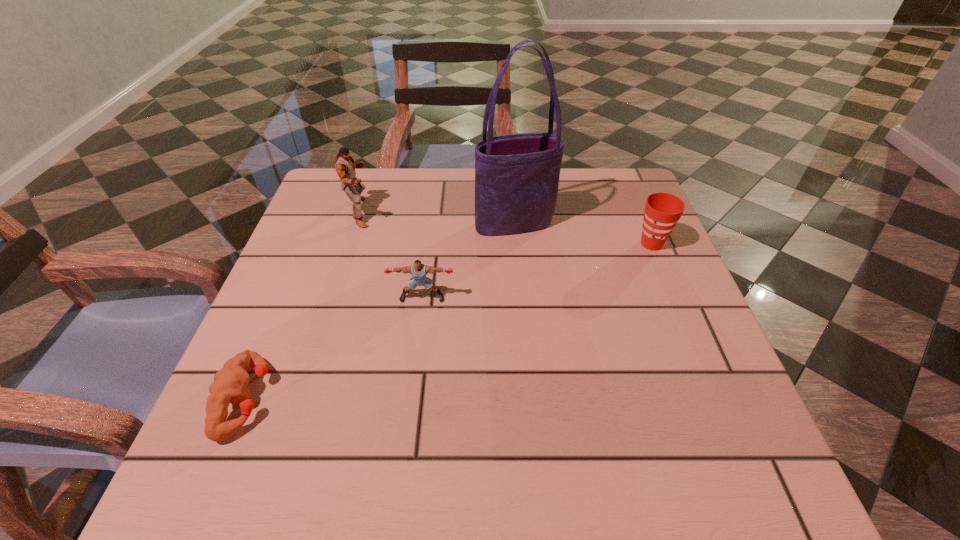
The image size is (960, 540). In order to click on blank area in the image that satisfies the following two spatial constraints: 1. on the front-facing side of the second object from left to right; 2. on the back side of the tote bag in this screenshot , I will do `click(356, 224)`.